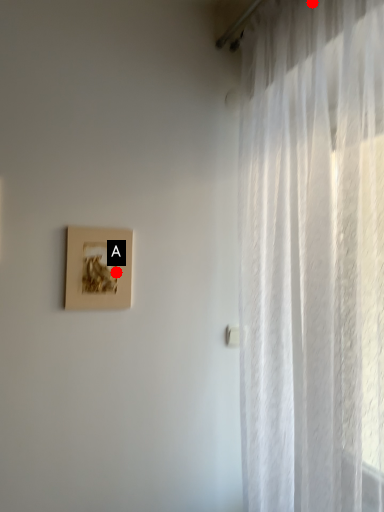
Question: Two points are circled on the image, labeled by A and B beside each circle. Which point is farther from the camera taking this photo?

Choices:
 (A) A is further
 (B) B is further

Answer: (A)